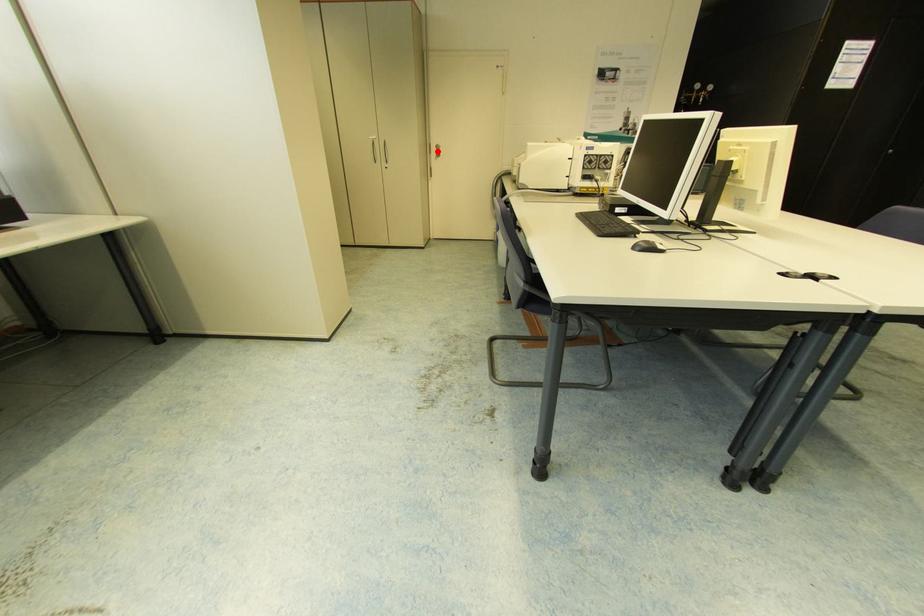
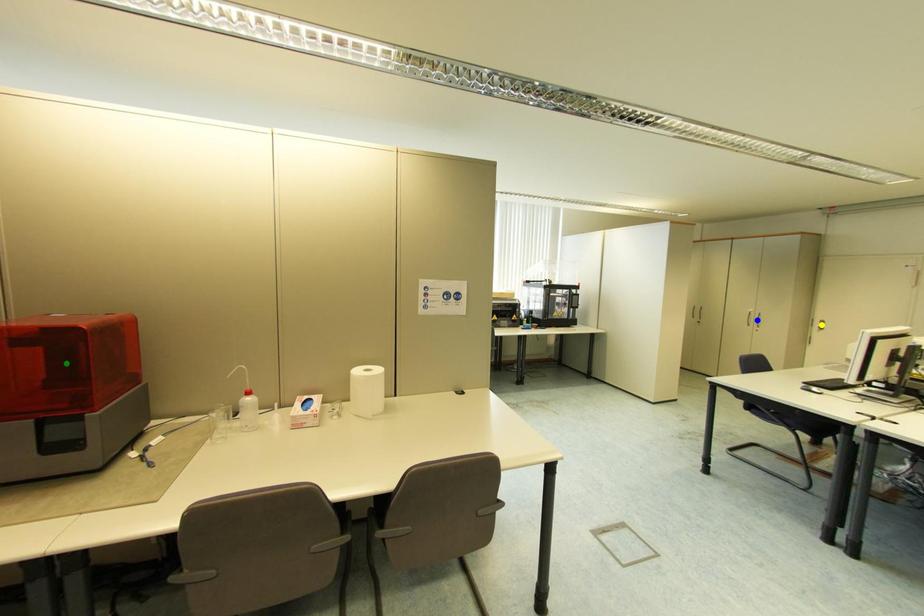
Question: I am providing you with two images of the same scene from different viewpoints. A red point is marked on the first image. You are given multiple points on the second image. Which point in image 2 represents the same 3d spot as the red point in image 1?

Choices:
 (A) yellow point
 (B) blue point
 (C) green point

Answer: (A)